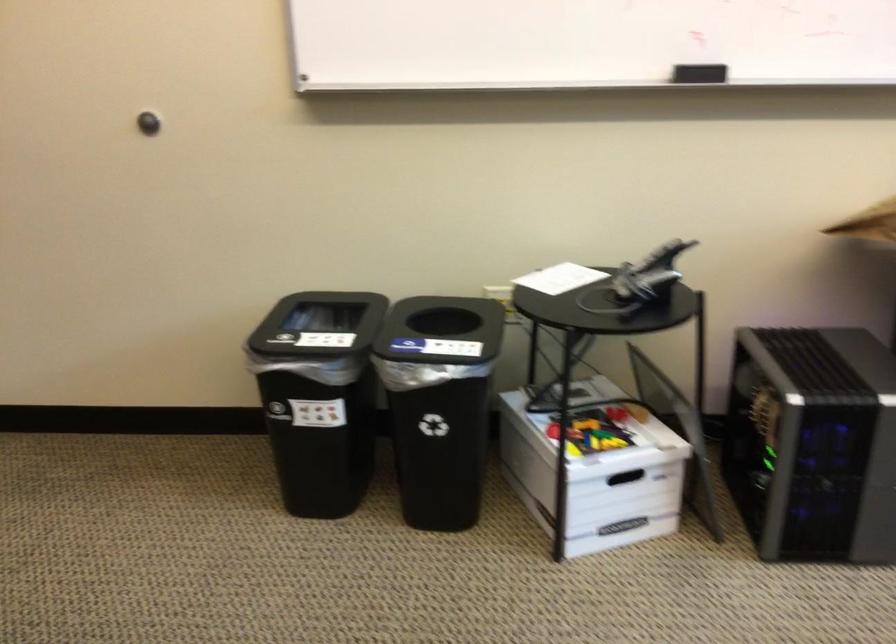
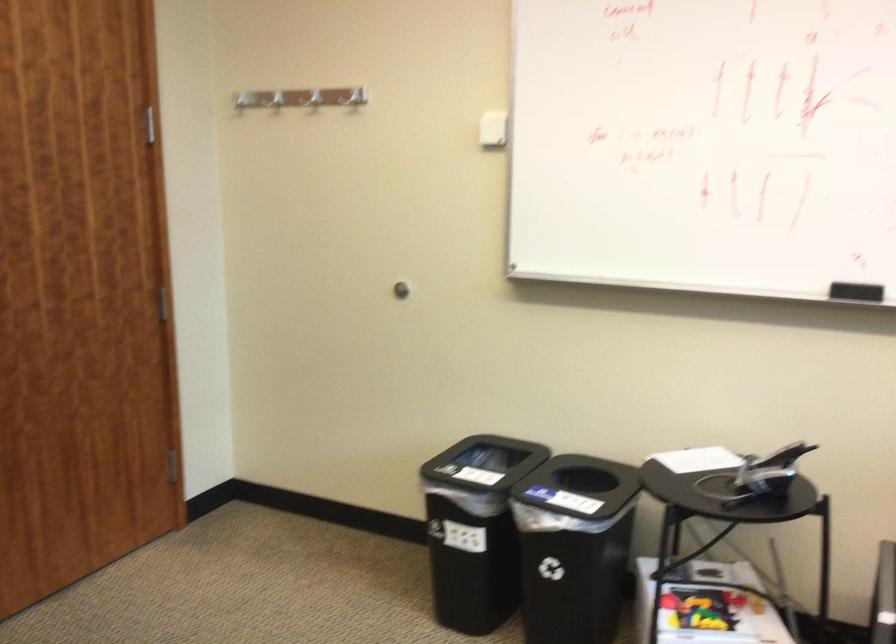
Based on the photo, what movement of the cameraman would produce the second image?

The cameraman moved toward right, backward.